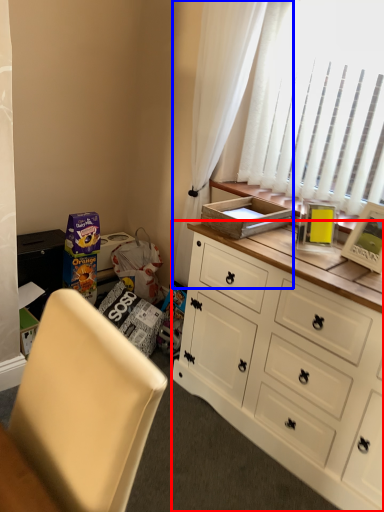
Question: Which of the following is the closest to the observer, cabinetry (highlighted by a red box) or curtain (highlighted by a blue box)?

Choices:
 (A) cabinetry
 (B) curtain

Answer: (A)